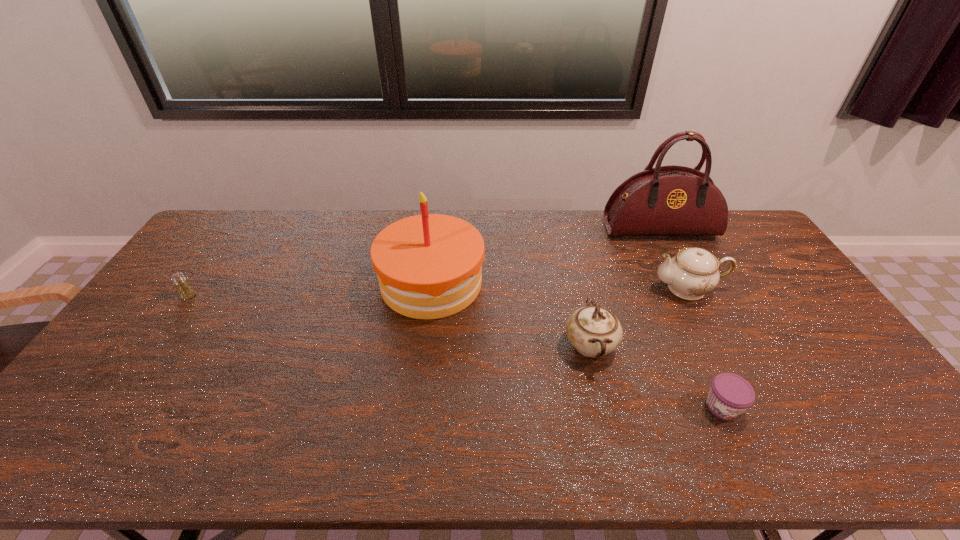
This screenshot has height=540, width=960. Identify the location of handbag. (672, 200).

Locate an element on the screen. birthday cake is located at coordinates (429, 266).

You are a GUI agent. You are given a task and a screenshot of the screen. Output one action in this format:
    pyautogui.click(x=<x>, y=<y>)
    Task: Click on the right chinaware
    Image resolution: width=960 pixels, height=540 pixels.
    Given the screenshot: What is the action you would take?
    pyautogui.click(x=693, y=272)

You are a GUI agent. You are given a task and a screenshot of the screen. Output one action in this format:
    pyautogui.click(x=<x>, y=<y>)
    Task: Click on the fourth object from right to left
    The height and width of the screenshot is (540, 960).
    Given the screenshot: What is the action you would take?
    pyautogui.click(x=594, y=331)

Find the location of `the left chinaware`. the left chinaware is located at coordinates (594, 331).

Image resolution: width=960 pixels, height=540 pixels. What are the coordinates of `saltshaker` in the screenshot? It's located at (185, 290).

Where is `jam`? The width and height of the screenshot is (960, 540). jam is located at coordinates (730, 395).

Locate an element on the screen. The height and width of the screenshot is (540, 960). free space located 0.060m on the front-facing side of the handbag is located at coordinates (671, 253).

Locate an element on the screen. This screenshot has width=960, height=540. blank area located on the right of the birthday cake is located at coordinates (513, 283).

At what (x,y) coordinates should I click in order to perform the action: click on vacant space situated at the spout of the farther chinaware. Please return your answer as a coordinate pair (x, y). The width and height of the screenshot is (960, 540). Looking at the image, I should click on (558, 288).